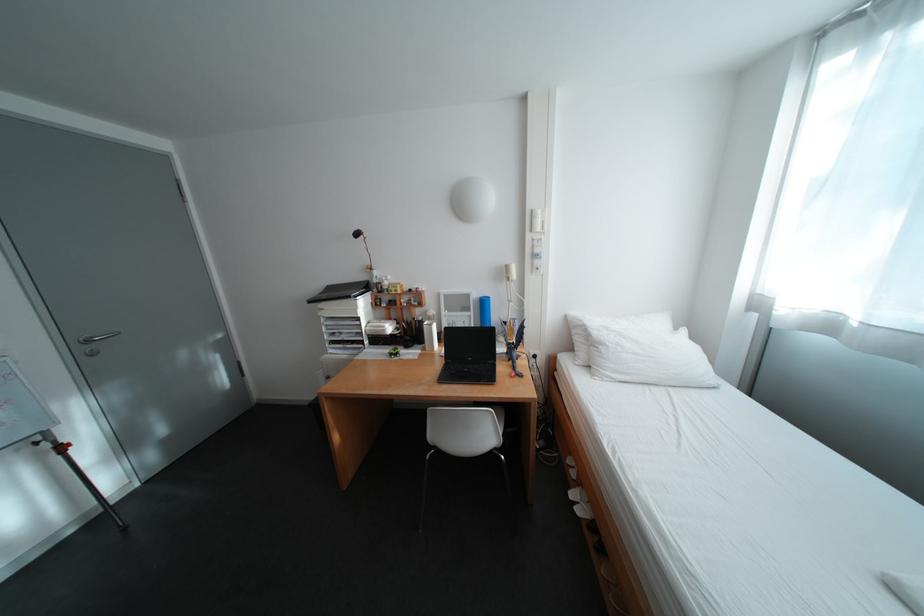
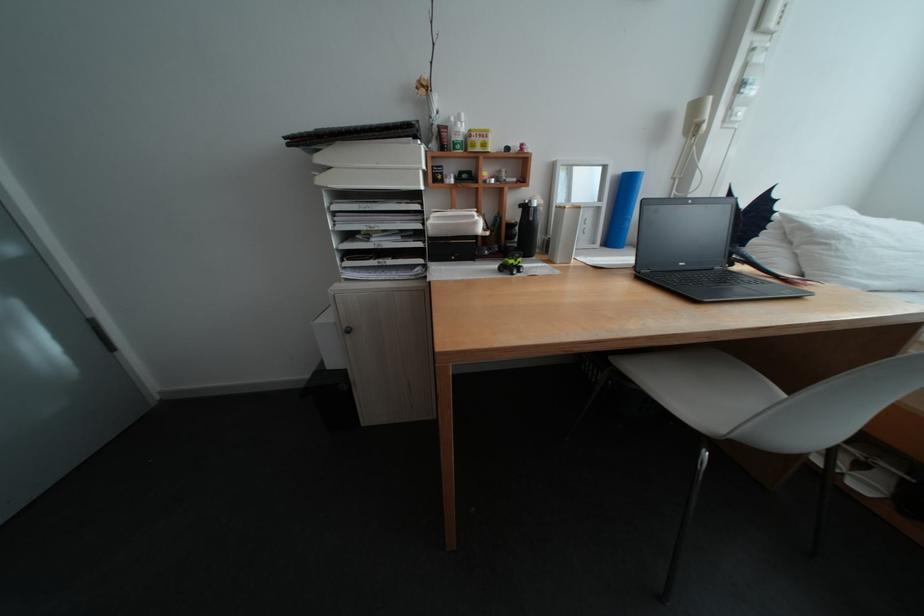
The point at [481,360] is marked in the first image. Where is the corresponding point in the second image?

(694, 265)